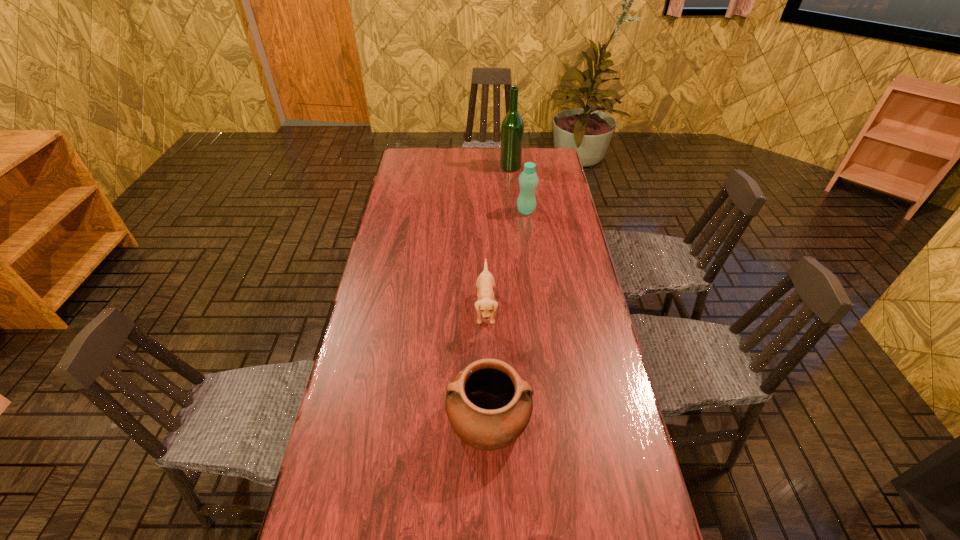
Identify the location of free region located 0.070m on the left of the pottery. The height and width of the screenshot is (540, 960). (420, 420).

The image size is (960, 540). I want to click on vacant space located 0.340m on the left side of the second nearest object, so coord(368,309).

This screenshot has height=540, width=960. What are the coordinates of `free space located 0.150m on the left side of the second nearest object` in the screenshot? It's located at (427, 309).

Where is `free space located on the left side of the second nearest object`? Image resolution: width=960 pixels, height=540 pixels. free space located on the left side of the second nearest object is located at coordinates (412, 309).

The height and width of the screenshot is (540, 960). What are the coordinates of `object located at the far edge` in the screenshot? It's located at (512, 127).

I want to click on object at the right edge, so click(x=528, y=180).

The width and height of the screenshot is (960, 540). What are the coordinates of `free space at the far edge of the desktop` in the screenshot? It's located at (449, 153).

In order to click on free location at the left edge in this screenshot , I will do `click(395, 288)`.

The height and width of the screenshot is (540, 960). In the image, there is a desktop. Identify the location of free region at the right edge. (576, 246).

This screenshot has width=960, height=540. Identify the location of vacant space at the far right corner of the desktop. tap(545, 160).